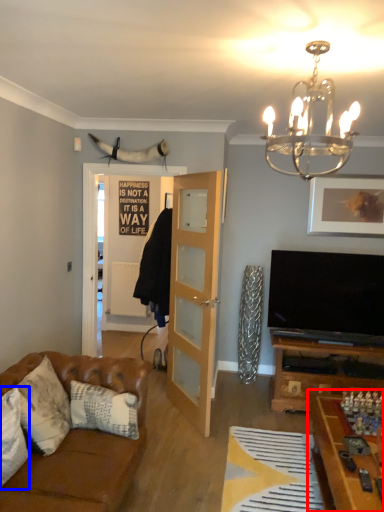
Question: Among these objects, which one is nearest to the camera, table (highlighted by a red box) or pillow (highlighted by a blue box)?

Choices:
 (A) table
 (B) pillow

Answer: (A)